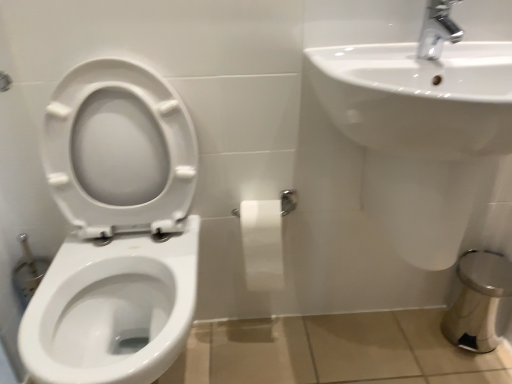
Question: Is white glossy toilet at left further to the viewer compared to white matte toilet paper at center?

Choices:
 (A) no
 (B) yes

Answer: (A)

Question: Does white glossy toilet at left have a greater height compared to white matte toilet paper at center?

Choices:
 (A) yes
 (B) no

Answer: (A)

Question: Would you say white glossy toilet at left is outside white matte toilet paper at center?

Choices:
 (A) no
 (B) yes

Answer: (B)

Question: Is white glossy toilet at left to the right of white matte toilet paper at center from the viewer's perspective?

Choices:
 (A) no
 (B) yes

Answer: (A)

Question: Is white glossy toilet at left beside white matte toilet paper at center?

Choices:
 (A) no
 (B) yes

Answer: (A)

Question: Is white glossy toilet at left shorter than white matte toilet paper at center?

Choices:
 (A) no
 (B) yes

Answer: (A)

Question: Does white glossy sink at upper right lie in front of white matte toilet paper at center?

Choices:
 (A) no
 (B) yes

Answer: (B)

Question: Is white glossy sink at upper right behind white matte toilet paper at center?

Choices:
 (A) yes
 (B) no

Answer: (B)

Question: Is white glossy sink at upper right taller than white matte toilet paper at center?

Choices:
 (A) no
 (B) yes

Answer: (B)

Question: Is white glossy sink at upper right thinner than white matte toilet paper at center?

Choices:
 (A) yes
 (B) no

Answer: (B)

Question: Are white glossy sink at upper right and white matte toilet paper at center beside each other?

Choices:
 (A) yes
 (B) no

Answer: (B)

Question: Is white glossy sink at upper right oriented away from white matte toilet paper at center?

Choices:
 (A) no
 (B) yes

Answer: (A)

Question: Is white glossy toilet at left wider than white glossy sink at upper right?

Choices:
 (A) yes
 (B) no

Answer: (A)